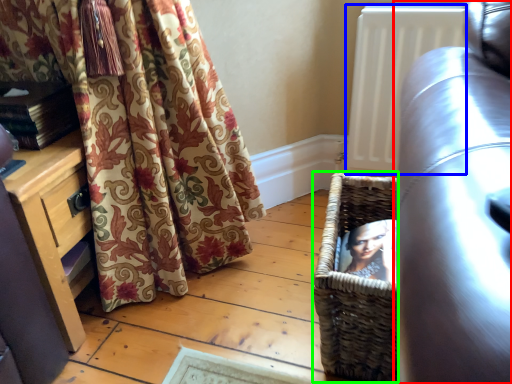
Question: Estimate the real-world distances between objects in this image. Which object is closer to studio couch (highlighted by a red box), radiator (highlighted by a blue box) or basket (highlighted by a green box)?

Choices:
 (A) radiator
 (B) basket

Answer: (B)